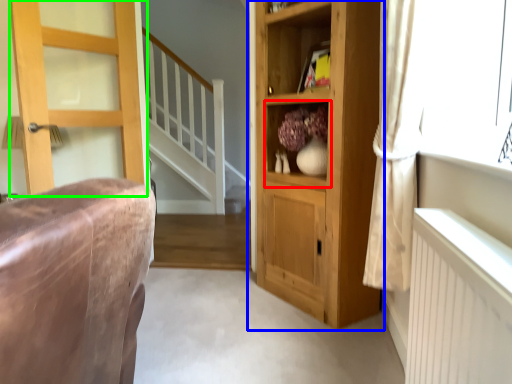
Question: Considering the real-world distances, which object is farthest from cabinet (highlighted by a red box)? cupboard (highlighted by a blue box) or door (highlighted by a green box)?

Choices:
 (A) cupboard
 (B) door

Answer: (B)